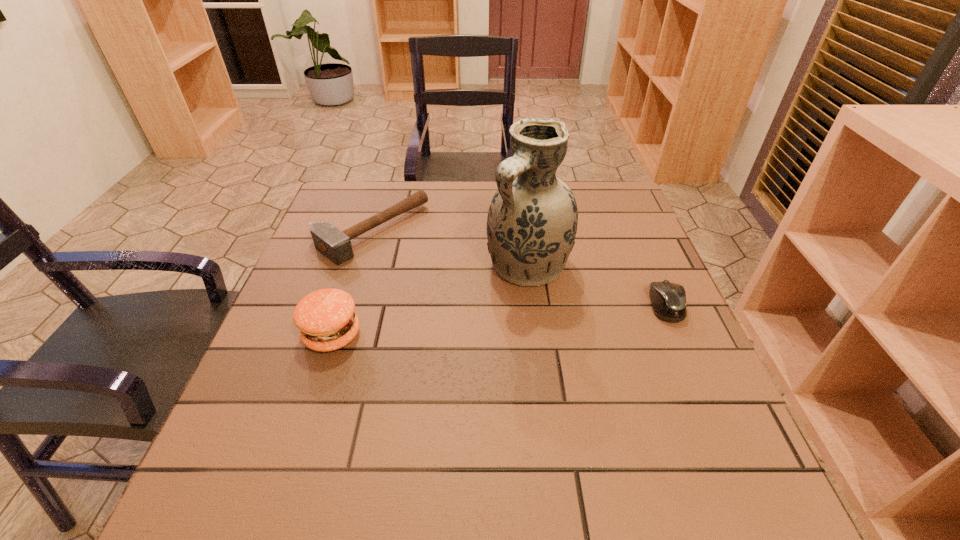
The height and width of the screenshot is (540, 960). Identify the location of the second tallest object. [326, 319].

The image size is (960, 540). I want to click on mouse, so click(x=668, y=299).

I want to click on vase, so click(x=532, y=220).

Find the location of `the second object from right to left`. the second object from right to left is located at coordinates (532, 220).

I want to click on hammer, so click(x=336, y=245).

At what (x,y) coordinates should I click in order to perform the action: click on free region located 0.210m on the right of the third shortest object. Please return your answer as a coordinate pair (x, y). The width and height of the screenshot is (960, 540). Looking at the image, I should click on (460, 335).

Where is `free spot located 0.350m on the back of the mouse`? The width and height of the screenshot is (960, 540). free spot located 0.350m on the back of the mouse is located at coordinates (623, 206).

This screenshot has width=960, height=540. Identify the location of free space located 0.080m with the handle on the side of the second object from right to left. (483, 307).

I want to click on free space located 0.370m with the handle on the side of the second object from right to left, so click(387, 395).

Where is `free region located 0.100m with the handle on the side of the second object from right to left`? The height and width of the screenshot is (540, 960). free region located 0.100m with the handle on the side of the second object from right to left is located at coordinates (477, 313).